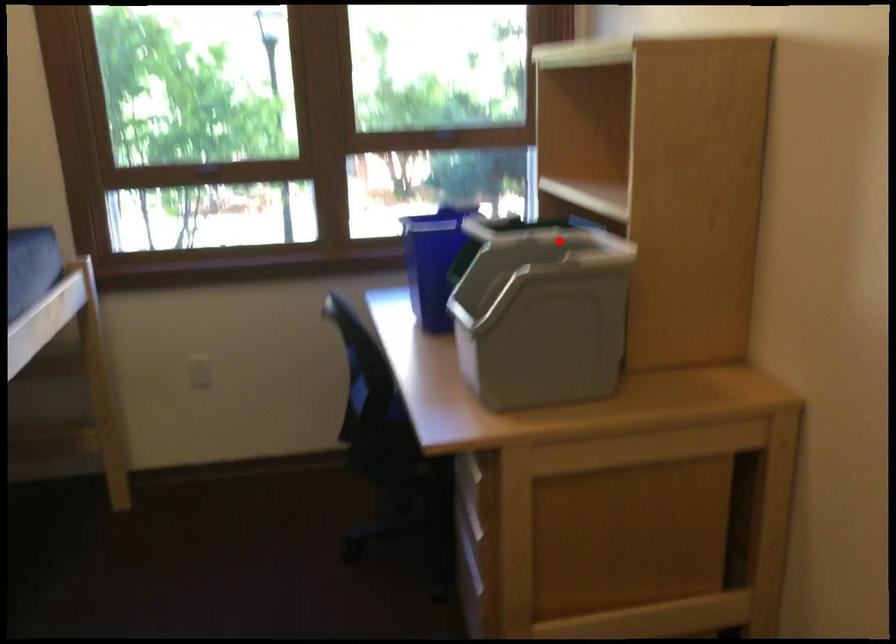
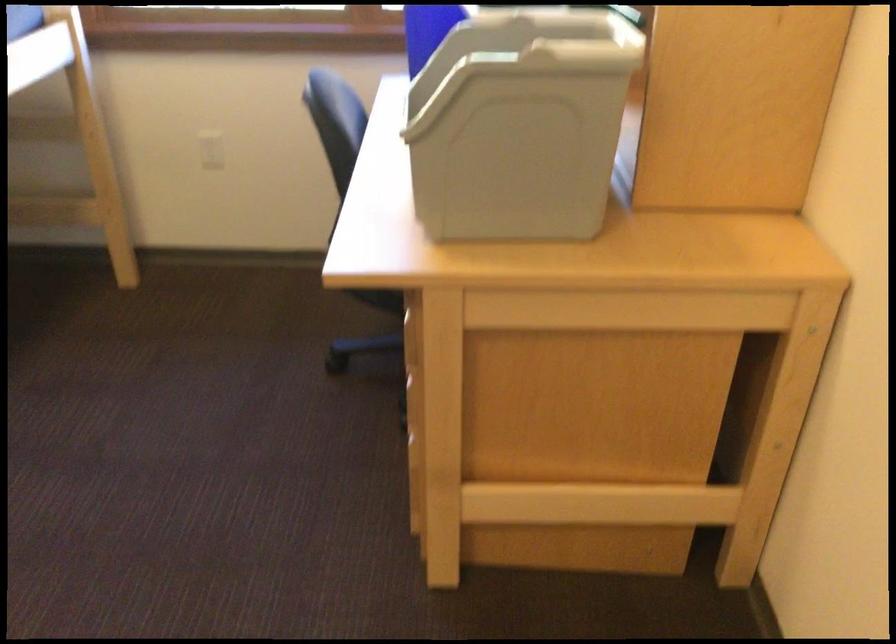
In the second image, find the point that corresponds to the highlighted location in the first image.

(565, 24)